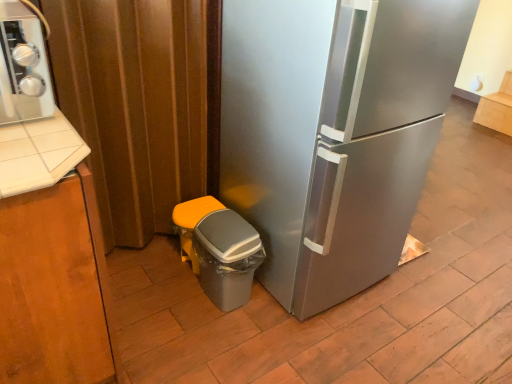
Question: Is matte wood cabinet at upper right, the 1th cabinetry positioned from the right, situated inside gray plastic trash can at lower left or outside?

Choices:
 (A) outside
 (B) inside

Answer: (A)

Question: In terms of size, does matte wood cabinet at upper right, the second cabinetry from the front, appear bigger or smaller than gray plastic trash can at lower left?

Choices:
 (A) small
 (B) big

Answer: (B)

Question: Based on their relative distances, which object is farther from the matte brown curtain at left?

Choices:
 (A) matte wood cabinet at upper right, placed as the 1th cabinetry when sorted from back to front
 (B) brushed wood cabinet at left, placed as the first cabinetry when sorted from left to right
 (C) gray plastic potty at lower left
 (D) stainless steel refrigerator at center
 (E) brushed metal stove at upper left

Answer: (A)

Question: Which is nearer to the matte wood cabinet at upper right, placed as the 1th cabinetry when sorted from back to front?

Choices:
 (A) gray plastic potty at lower left
 (B) gray plastic trash can at lower left
 (C) stainless steel refrigerator at center
 (D) matte brown curtain at left
 (E) brushed metal stove at upper left

Answer: (C)